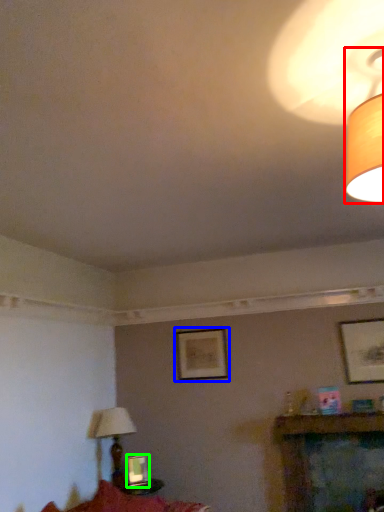
Question: Based on their relative distances, which object is nearer to lamp (highlighted by a red box)? Choose from picture frame (highlighted by a blue box) and picture frame (highlighted by a green box).

Choices:
 (A) picture frame
 (B) picture frame

Answer: (A)